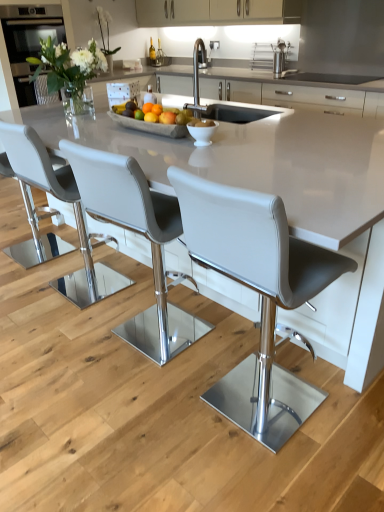
Measure the distance between point [183,2] and camera.

4.42 meters.

Locate an element on the screen. The image size is (384, 512). white leather stool at center, the 2th chair when ordered from right to left is located at coordinates (134, 231).

This screenshot has height=512, width=384. Describe the element at coordinates (275, 183) in the screenshot. I see `white glossy countertop at center` at that location.

What are the coordinates of `white leather chair at left, positioned as the 2th chair in left-to-right order` in the screenshot? It's located at (48, 183).

Which is more to the left, matte gray chair at center, which is the 1th chair in right-to-left order, or matte white cabinets at upper center?

matte white cabinets at upper center.

Considering the sizes of matte gray chair at center, which is the 1th chair in right-to-left order, and matte white cabinets at upper center in the image, is matte gray chair at center, which is the 1th chair in right-to-left order, taller or shorter than matte white cabinets at upper center?

Considering their sizes, matte gray chair at center, which is the 1th chair in right-to-left order, has more height than matte white cabinets at upper center.

Does matte gray chair at center, which is the 1th chair in right-to-left order, lie in front of matte white cabinets at upper center?

Yes.

The image size is (384, 512). Find the location of `chair that is the 3rd object located behind the white glossy countertop at center`. chair that is the 3rd object located behind the white glossy countertop at center is located at coordinates (36, 173).

Does white leather bar stool at left, the 4th chair viewed from the right, turn towards white glossy countertop at center?

Yes, white leather bar stool at left, the 4th chair viewed from the right, faces towards white glossy countertop at center.

Looking at their sizes, would you say white leather bar stool at left, the first chair positioned from the left, is wider or thinner than white glossy countertop at center?

In the image, white leather bar stool at left, the first chair positioned from the left, appears to be more narrow than white glossy countertop at center.

Is white leather bar stool at left, the 4th chair viewed from the right, situated inside white glossy countertop at center or outside?

white leather bar stool at left, the 4th chair viewed from the right, is spatially positioned inside white glossy countertop at center.

Who is smaller, orange matte at center, the first orange in the top-to-bottom sequence, or matte gray chair at center, which is the 1th chair in right-to-left order?

With smaller size is orange matte at center, the first orange in the top-to-bottom sequence.

Between orange matte at center, positioned as the second orange in bottom-to-top order, and matte gray chair at center, which is the 1th chair in right-to-left order, which one has more height?

Standing taller between the two is matte gray chair at center, which is the 1th chair in right-to-left order.

From a real-world perspective, is orange matte at center, arranged as the 1th orange when viewed from the back, physically located above or below matte gray chair at center, which is the 1th chair in right-to-left order?

Clearly, from a real-world perspective, orange matte at center, arranged as the 1th orange when viewed from the back, is above matte gray chair at center, which is the 1th chair in right-to-left order.

Is orange matte at center, arranged as the 1th orange when viewed from the back, closer to camera compared to matte gray chair at center, which is the 1th chair in right-to-left order?

That is False.

Which point is more distant from viewer, (272, 420) or (123, 330)?

The point (123, 330) is behind.

In the scene shown: Is white leather stool at center, marked as the third chair in a left-to-right arrangement, inside matte gray chair at center, which is the fourth chair in left-to-right order?

No, white leather stool at center, marked as the third chair in a left-to-right arrangement, is not surrounded by matte gray chair at center, which is the fourth chair in left-to-right order.

How far apart are matte gray chair at center, which is the fourth chair in left-to-right order, and white leather stool at center, the 2th chair when ordered from right to left?

A distance of 35.81 inches exists between matte gray chair at center, which is the fourth chair in left-to-right order, and white leather stool at center, the 2th chair when ordered from right to left.

Between matte gray chair at center, which is the 1th chair in right-to-left order, and white leather stool at center, the 2th chair when ordered from right to left, which one has smaller size?

matte gray chair at center, which is the 1th chair in right-to-left order, is smaller.

From a real-world perspective, between stainless steel rack at upper center and matte black oven at upper left, who is vertically higher?

matte black oven at upper left is physically above.

Considering the relative sizes of stainless steel rack at upper center and matte black oven at upper left in the image provided, is stainless steel rack at upper center shorter than matte black oven at upper left?

Indeed, stainless steel rack at upper center has a lesser height compared to matte black oven at upper left.

Is stainless steel rack at upper center positioned beyond the bounds of matte black oven at upper left?

Yes, stainless steel rack at upper center is not within matte black oven at upper left.

Is stainless steel rack at upper center with matte black oven at upper left?

They are not placed beside each other.

Considering the relative sizes of white leather chair at left, positioned as the 2th chair in left-to-right order, and white glossy countertop at center in the image provided, is white leather chair at left, positioned as the 2th chair in left-to-right order, shorter than white glossy countertop at center?

Incorrect, the height of white leather chair at left, positioned as the 2th chair in left-to-right order, does not fall short of that of white glossy countertop at center.

The height and width of the screenshot is (512, 384). Find the location of `chair that is the 1st object located below the white glossy countertop at center (from the image's perspective)`. chair that is the 1st object located below the white glossy countertop at center (from the image's perspective) is located at coordinates (48, 183).

Which of these two, white leather chair at left, positioned as the 2th chair in left-to-right order, or white glossy countertop at center, is thinner?

Thinner between the two is white leather chair at left, positioned as the 2th chair in left-to-right order.

From a real-world perspective, who is located higher, white leather chair at left, positioned as the 2th chair in left-to-right order, or white glossy countertop at center?

white leather chair at left, positioned as the 2th chair in left-to-right order, from a real-world perspective.

Is white leather chair at left, positioned as the 2th chair in left-to-right order, at the left side of orange matte at center, positioned as the second orange in bottom-to-top order?

Yes, white leather chair at left, positioned as the 2th chair in left-to-right order, is to the left of orange matte at center, positioned as the second orange in bottom-to-top order.

From a real-world perspective, between white leather chair at left, which appears as the third chair when viewed from the right, and orange matte at center, the first orange in the top-to-bottom sequence, who is vertically higher?

From a 3D spatial view, orange matte at center, the first orange in the top-to-bottom sequence, is above.

Based on the photo, is white leather chair at left, which appears as the third chair when viewed from the right, aimed at orange matte at center, the first orange in the top-to-bottom sequence?

Yes, white leather chair at left, which appears as the third chair when viewed from the right, is oriented towards orange matte at center, the first orange in the top-to-bottom sequence.

Between white leather chair at left, positioned as the 2th chair in left-to-right order, and orange matte at center, positioned as the second orange in bottom-to-top order, which one has less height?

Standing shorter between the two is orange matte at center, positioned as the second orange in bottom-to-top order.

The width and height of the screenshot is (384, 512). Find the location of `cabinetry on the left of matte gray chair at center, which is the fourth chair in left-to-right order`. cabinetry on the left of matte gray chair at center, which is the fourth chair in left-to-right order is located at coordinates (216, 12).

Where is `countertop in front of the white leather bar stool at left, the first chair positioned from the left`? The height and width of the screenshot is (512, 384). countertop in front of the white leather bar stool at left, the first chair positioned from the left is located at coordinates (275, 183).

Considering their positions, is white leather chair at left, which appears as the third chair when viewed from the right, positioned closer to white leather bar stool at left, the first chair positioned from the left, than matte gray chair at center, which is the fourth chair in left-to-right order?

Among the two, white leather chair at left, which appears as the third chair when viewed from the right, is located nearer to white leather bar stool at left, the first chair positioned from the left.

Which object lies nearer to the anchor point orange matte at center, the first orange in the top-to-bottom sequence, white glossy countertop at center or matte gray chair at center, which is the fourth chair in left-to-right order?

white glossy countertop at center is closer to orange matte at center, the first orange in the top-to-bottom sequence.

From the image, which object appears to be nearer to orange matte at center, placed as the 2th orange when sorted from front to back, white leather stool at center, the 2th chair when ordered from right to left, or matte gray chair at center, which is the 1th chair in right-to-left order?

Among the two, white leather stool at center, the 2th chair when ordered from right to left, is located nearer to orange matte at center, placed as the 2th orange when sorted from front to back.

Which object lies further to the anchor point matte gray chair at center, which is the 1th chair in right-to-left order, white glossy countertop at center or yellow matte orange at center, the 1th orange positioned from the bottom?

yellow matte orange at center, the 1th orange positioned from the bottom.

Considering their positions, is white leather bar stool at left, the 4th chair viewed from the right, positioned closer to white leather chair at left, positioned as the 2th chair in left-to-right order, than orange matte at center, positioned as the second orange in bottom-to-top order?

The object closer to white leather chair at left, positioned as the 2th chair in left-to-right order, is white leather bar stool at left, the 4th chair viewed from the right.

When comparing their distances from white leather bar stool at left, the first chair positioned from the left, does white glossy countertop at center or stainless steel rack at upper center seem closer?

white glossy countertop at center is positioned closer to the anchor white leather bar stool at left, the first chair positioned from the left.

In the scene shown: From the image, which object appears to be farther from matte black oven at upper left, orange matte at center, arranged as the 1th orange when viewed from the back, or matte gray chair at center, which is the fourth chair in left-to-right order?

matte gray chair at center, which is the fourth chair in left-to-right order, is further to matte black oven at upper left.

From the image, which object appears to be farther from white leather stool at center, marked as the third chair in a left-to-right arrangement, white glossy countertop at center or white leather chair at left, positioned as the 2th chair in left-to-right order?

Based on the image, white glossy countertop at center appears to be further to white leather stool at center, marked as the third chair in a left-to-right arrangement.

The height and width of the screenshot is (512, 384). I want to click on appliance between matte white cabinets at upper center and white leather bar stool at left, the 4th chair viewed from the right, vertically, so click(6, 78).

This screenshot has width=384, height=512. Identify the location of bowl between white leather stool at center, marked as the third chair in a left-to-right arrangement, and matte black oven at upper left, along the z-axis. [202, 131].

At what (x,y) coordinates should I click in order to perform the action: click on countertop between matte gray chair at center, which is the fourth chair in left-to-right order, and yellow matte orange at center, the 1th orange positioned from the bottom, along the z-axis. Please return your answer as a coordinate pair (x, y). The height and width of the screenshot is (512, 384). Looking at the image, I should click on (275, 183).

The width and height of the screenshot is (384, 512). I want to click on countertop between matte white cabinets at upper center and white leather chair at left, which appears as the third chair when viewed from the right, from top to bottom, so click(x=275, y=183).